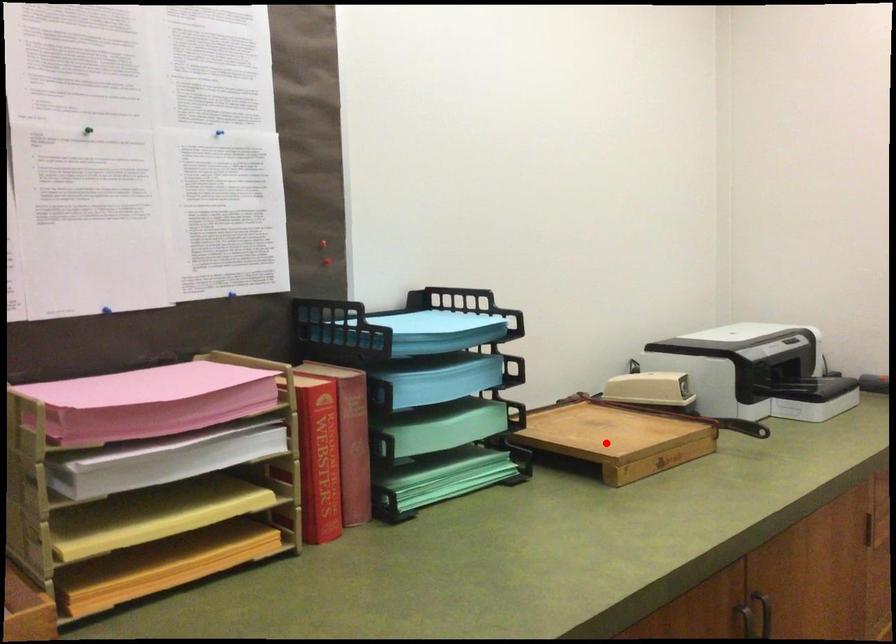
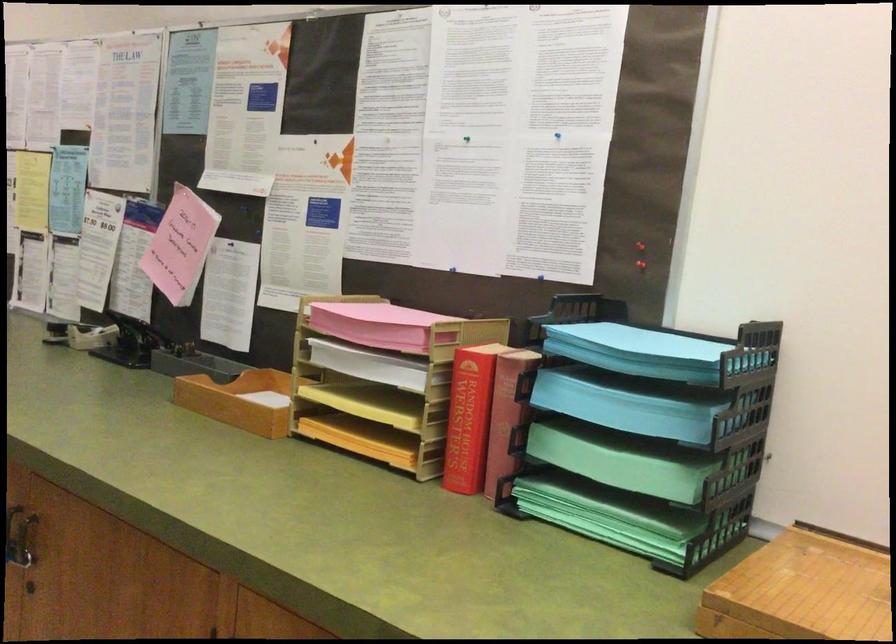
Question: I am providing you with two images of the same scene from different viewpoints. Image1 has a red point marked. In image2, the corresponding 3D location appears at what relative position? Reply with the corresponding letter.

Choices:
 (A) Closer
 (B) Farther

Answer: (A)